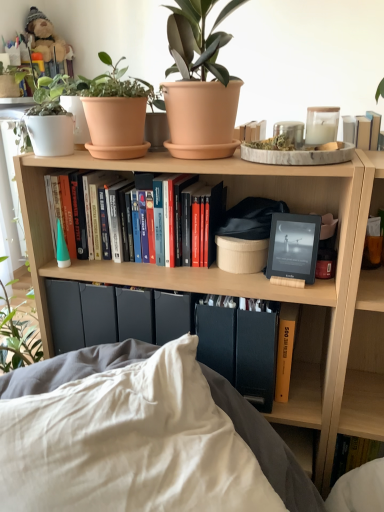
Question: Considering their positions, is white soft pillow at lower center located in front of or behind terracotta pot at upper center?

Choices:
 (A) behind
 (B) front

Answer: (B)

Question: Considering the relative positions of white soft pillow at lower center and terracotta pot at upper center in the image provided, is white soft pillow at lower center to the left or to the right of terracotta pot at upper center?

Choices:
 (A) right
 (B) left

Answer: (B)

Question: Estimate the real-world distances between objects in this image. Which object is closer to the wooden bookshelf at center?

Choices:
 (A) teddy bear at upper left
 (B) black matte book at center
 (C) hardcover books at center, the 2th book ordered from the bottom
 (D) yellow matte book at lower right, the 2th book in the left-to-right sequence
 (E) matte black e-reader at center

Answer: (B)

Question: Which object is positioned farthest from the white soft pillow at lower center?

Choices:
 (A) matte black e-reader at center
 (B) hardcover books at center, placed as the first book when sorted from left to right
 (C) yellow matte book at lower right, the first book from the right
 (D) terracotta clay pot at upper center
 (E) terracotta pot at upper center

Answer: (E)